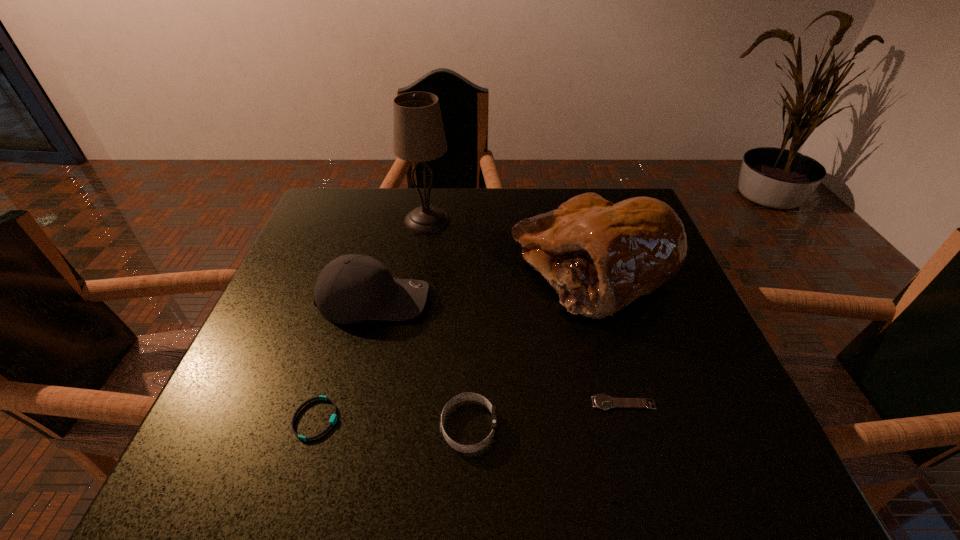
Image resolution: width=960 pixels, height=540 pixels. In order to click on free location located on the filling side of the second tallest object in this screenshot , I will do `click(432, 269)`.

The width and height of the screenshot is (960, 540). What are the coordinates of `vacant space located 0.360m on the filling side of the second tallest object` in the screenshot? It's located at (360, 269).

Locate an element on the screen. free space located 0.110m on the front brim of the third tallest object is located at coordinates [x=479, y=300].

Where is `free spot located on the outer surface of the right wristband`? free spot located on the outer surface of the right wristband is located at coordinates (674, 427).

Locate an element on the screen. free space located on the buckle of the fifth tallest object is located at coordinates (472, 419).

Where is `vacant space located 0.350m on the left of the watch`? vacant space located 0.350m on the left of the watch is located at coordinates (394, 403).

Locate an element on the screen. This screenshot has width=960, height=540. lampshade that is positioned at the far edge is located at coordinates (418, 134).

The image size is (960, 540). I want to click on bread positioned at the far edge, so click(x=600, y=257).

At what (x,y) coordinates should I click in order to perform the action: click on baseball cap present at the left edge. Please return your answer as a coordinate pair (x, y). Image resolution: width=960 pixels, height=540 pixels. Looking at the image, I should click on (352, 288).

Image resolution: width=960 pixels, height=540 pixels. I want to click on wristband that is at the left edge, so (x=333, y=420).